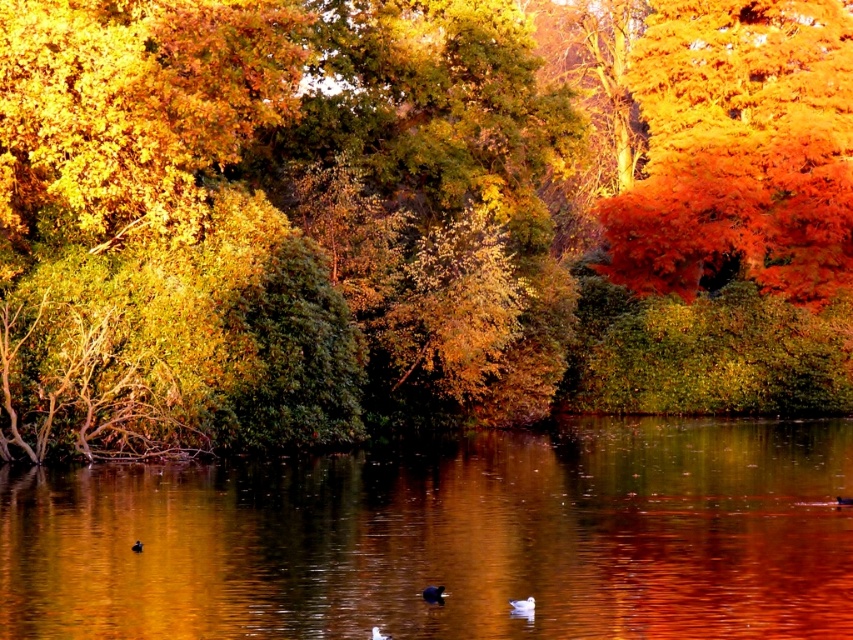
Question: Is shiny black duck at center bigger than matte brown duck at lower center?

Choices:
 (A) no
 (B) yes

Answer: (B)

Question: Does golden foliage at center appear over white matte duck at lower center?

Choices:
 (A) no
 (B) yes

Answer: (B)

Question: Estimate the real-world distances between objects in this image. Which object is farther from the white matte duck at lower center?

Choices:
 (A) vivid orange leaves at upper right
 (B) matte brown duck at lower center
 (C) shiny black duck at center
 (D) smooth reflective water at center

Answer: (A)

Question: Considering the real-world distances, which object is farthest from the shiny black duck at center?

Choices:
 (A) smooth reflective water at center
 (B) black matte duck at center
 (C) golden foliage at center
 (D) white matte duck at lower center

Answer: (C)

Question: Can you confirm if golden foliage at center is thinner than matte brown duck at lower center?

Choices:
 (A) yes
 (B) no

Answer: (B)

Question: Based on their relative distances, which object is nearer to the smooth reflective water at center?

Choices:
 (A) matte brown duck at lower center
 (B) black matte duck at center
 (C) white matte duck at lower center

Answer: (B)